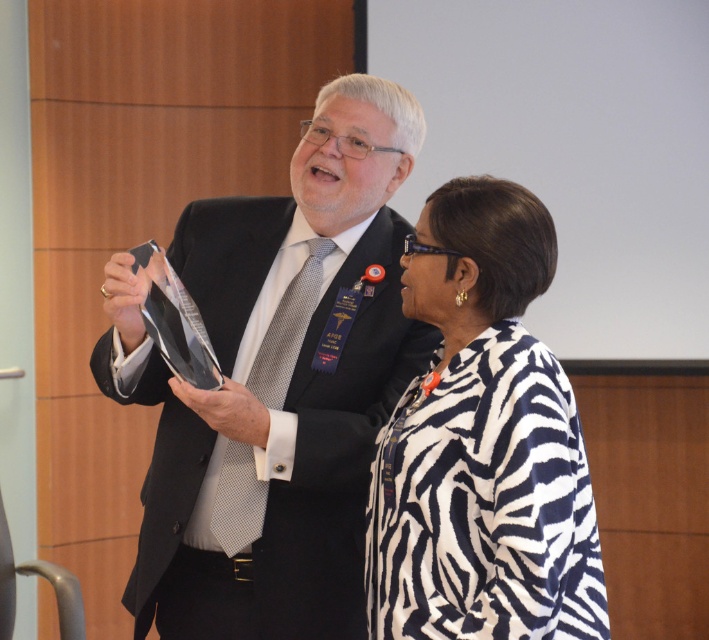
You are standing at the origin of the coordinate system in the image. You see two points labeled as point (489, 268) and point (259, 358). Which point is closer to you?

Point (489, 268) is in front of point (259, 358), so it is closer to you.

You are a photographer at the event and need to adjust your focus. Since the matte black suit at center and the gray dotted tie at center are both important, which one should you focus on first to ensure it appears sharp in the photo?

The matte black suit at center is closer to the viewer than the gray dotted tie at center, so focusing on it first will ensure both appear sharp as you adjust the focus.